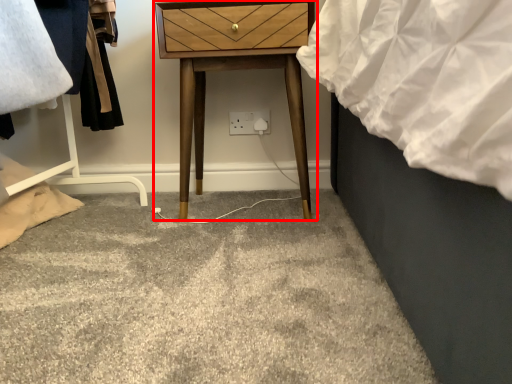
Question: From the image's perspective, where is nightstand (annotated by the red box) located in relation to electric outlet in the image?

Choices:
 (A) below
 (B) above

Answer: (B)